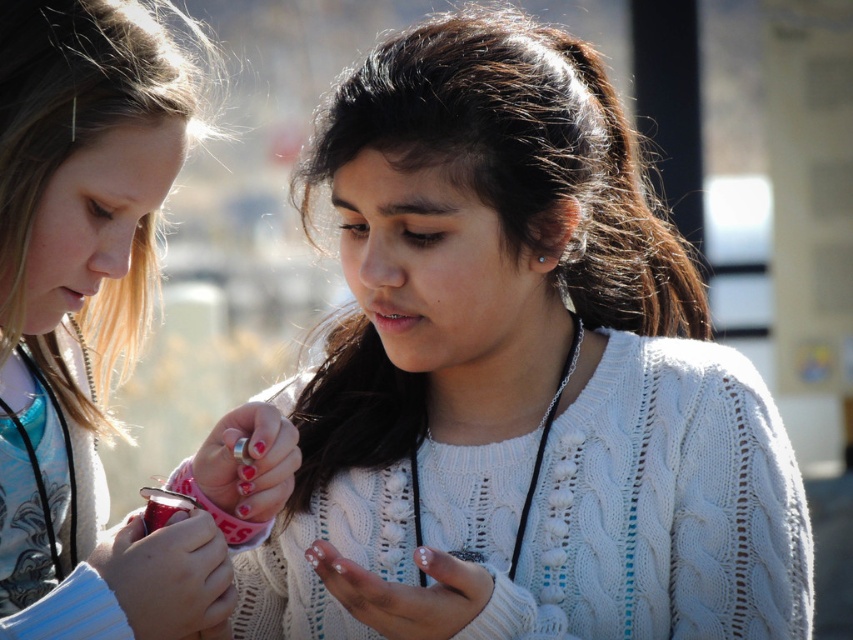
Question: Is white knitted sweater at center closer to the viewer compared to matte white sweater at center?

Choices:
 (A) no
 (B) yes

Answer: (A)

Question: Can you confirm if white knitted sweater at center is smaller than matte white sweater at center?

Choices:
 (A) no
 (B) yes

Answer: (A)

Question: Which point is farther to the camera?

Choices:
 (A) matte white sweater at center
 (B) white knitted sweater at center

Answer: (B)

Question: Which point is farther to the camera?

Choices:
 (A) (256, 426)
 (B) (581, 563)

Answer: (B)

Question: Where is white knitted sweater at center located in relation to matte white sweater at center in the image?

Choices:
 (A) above
 (B) below

Answer: (B)

Question: Which point is farther from the camera taking this photo?

Choices:
 (A) (x=67, y=520)
 (B) (x=581, y=124)

Answer: (B)